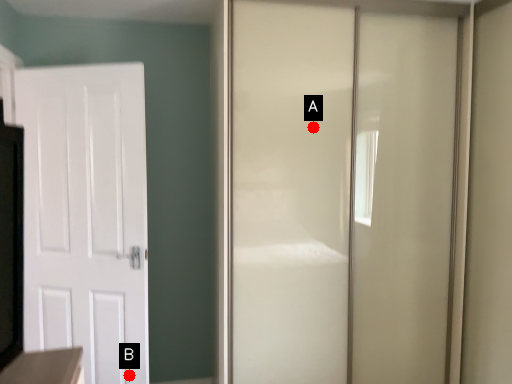
Question: Two points are circled on the image, labeled by A and B beside each circle. Which of the following is the farthest from the observer?

Choices:
 (A) A is further
 (B) B is further

Answer: (B)